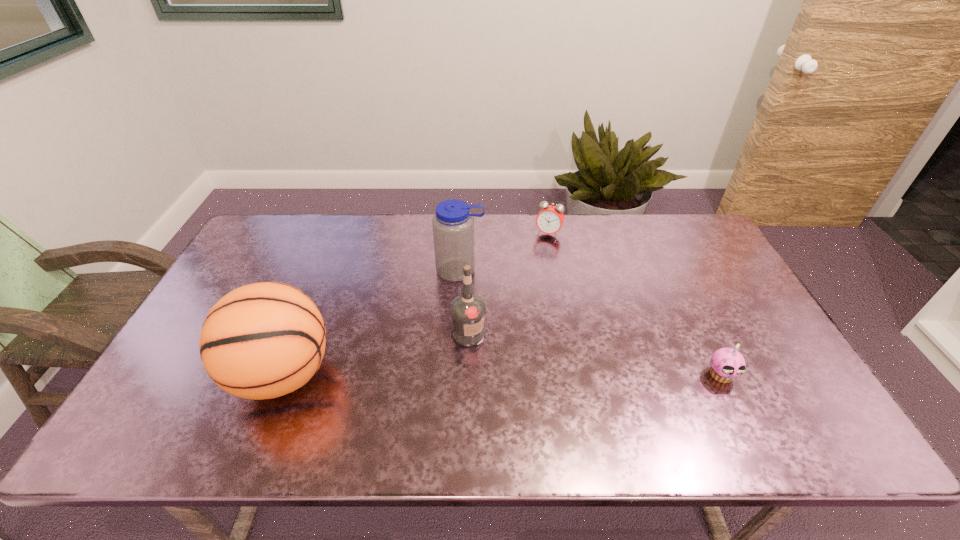
The width and height of the screenshot is (960, 540). I want to click on object present at the right edge, so click(727, 364).

Find the location of a particular element. object that is at the near right corner is located at coordinates (727, 364).

In the image, there is a desktop. Identify the location of free space at the far edge. The height and width of the screenshot is (540, 960). (338, 214).

I want to click on vacant space at the near edge of the desktop, so click(x=693, y=394).

Locate an element on the screen. Image resolution: width=960 pixels, height=540 pixels. free location at the left edge of the desktop is located at coordinates (184, 368).

This screenshot has width=960, height=540. In the image, there is a desktop. In order to click on vacant space at the right edge in this screenshot , I will do point(728,348).

Locate an element on the screen. vacant space at the far left corner of the desktop is located at coordinates (308, 217).

This screenshot has height=540, width=960. Identify the location of free region at the far right corner of the desktop. (667, 238).

Locate an element on the screen. Image resolution: width=960 pixels, height=540 pixels. free space between the basketball and the water bottle is located at coordinates (372, 322).

The width and height of the screenshot is (960, 540). Find the location of `vacant area that lies between the basketball and the rightmost object`. vacant area that lies between the basketball and the rightmost object is located at coordinates (502, 375).